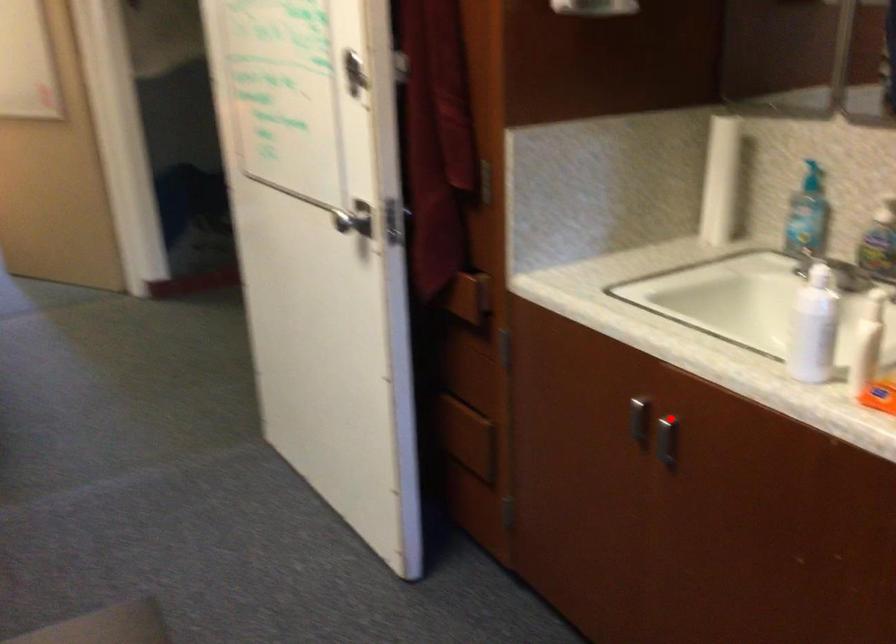
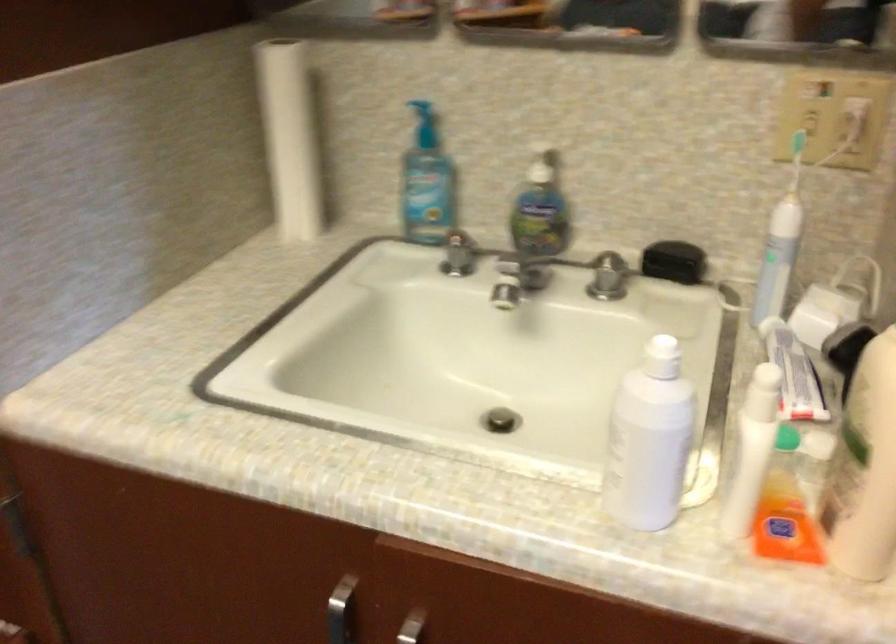
Question: I am providing you with two images of the same scene from different viewpoints. Given a red point in image1, look at the same physical point in image2. Is it:

Choices:
 (A) Closer to the viewpoint
 (B) Farther from the viewpoint

Answer: (A)